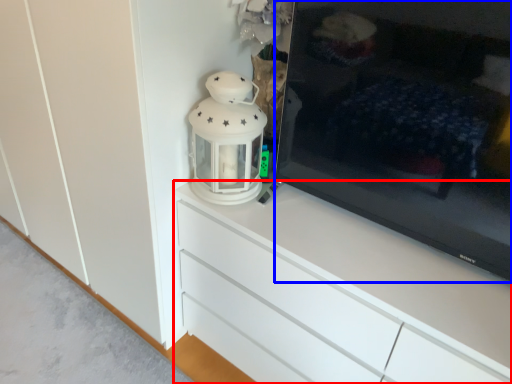
Question: Which point is further to the camera, chest of drawers (highlighted by a red box) or television (highlighted by a blue box)?

Choices:
 (A) chest of drawers
 (B) television

Answer: (A)